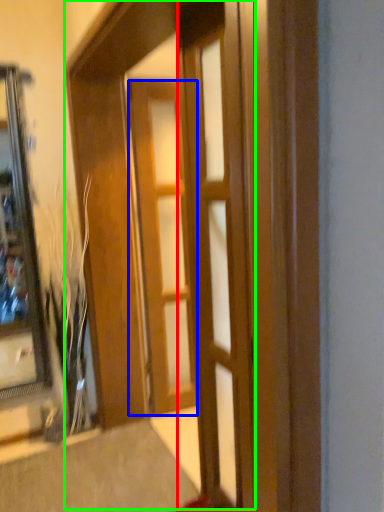
Question: Based on their relative distances, which object is farther from door (highlighted by a red box)? Choose from door (highlighted by a blue box) and barn door (highlighted by a green box).

Choices:
 (A) door
 (B) barn door

Answer: (A)